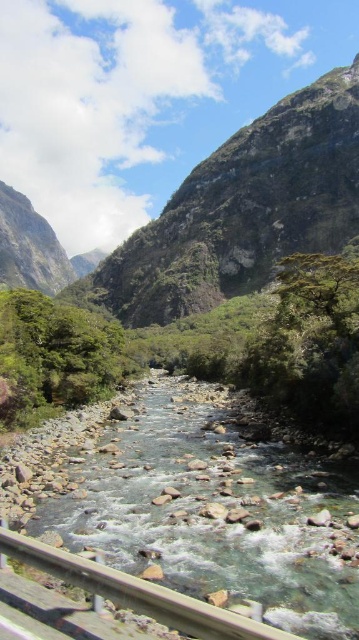
You are standing at the wooden rail at lower left and want to climb to the green rocky mountain at upper center. Which direction should you move to reach the mountain?

You should move upward from the wooden rail at lower left to reach the green rocky mountain at upper center because the mountain is taller than the rail.